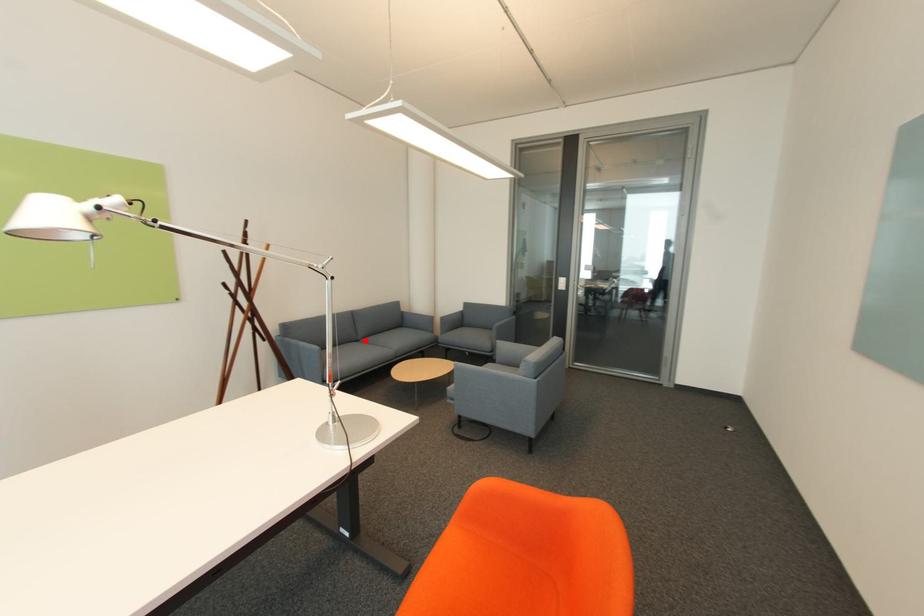
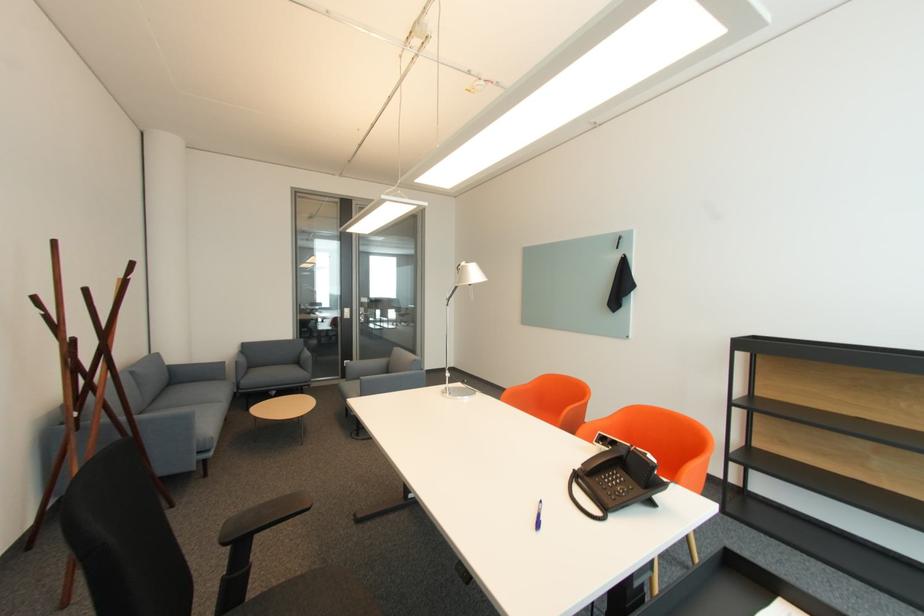
Question: I am providing you with two images of the same scene from different viewpoints. Given a red point in image1, look at the same physical point in image2. Is it:

Choices:
 (A) Closer to the viewpoint
 (B) Farther from the viewpoint

Answer: (B)